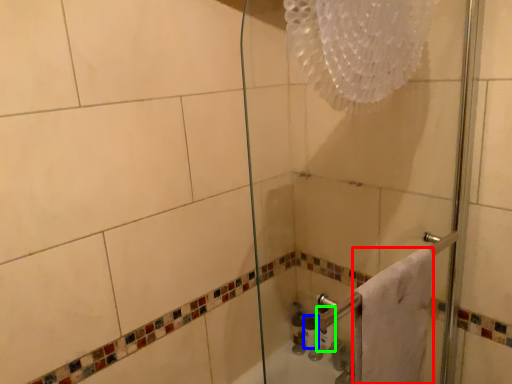
Question: Which object is positioned farthest from towel (highlighted by a red box)? Select from toiletry (highlighted by a blue box) and toilet paper (highlighted by a green box).

Choices:
 (A) toiletry
 (B) toilet paper

Answer: (A)